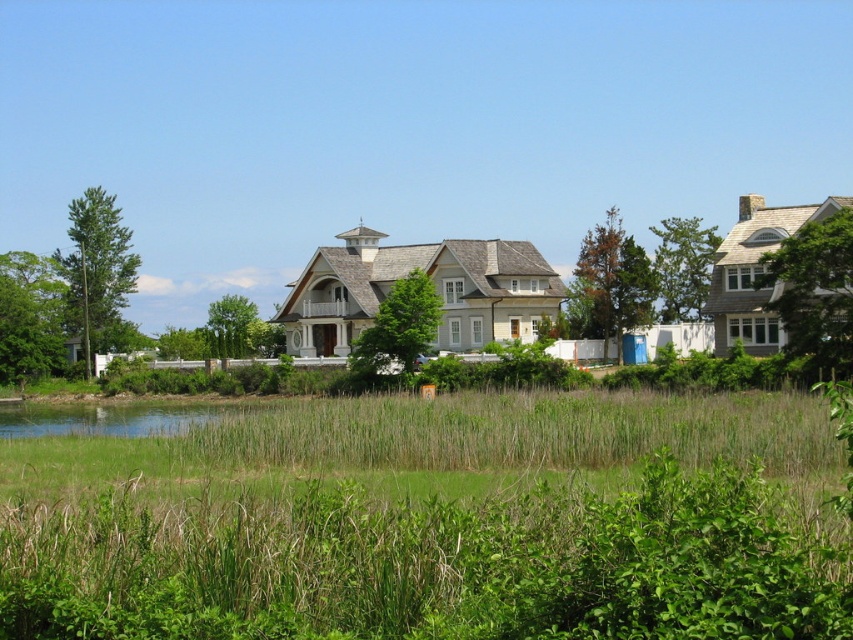
Who is positioned more to the right, green grass at center or clear water at lower left?

green grass at center is more to the right.

Does point (80, 573) lie in front of point (74, 432)?

Yes, point (80, 573) is closer to viewer.

The height and width of the screenshot is (640, 853). I want to click on green grass at center, so click(x=440, y=522).